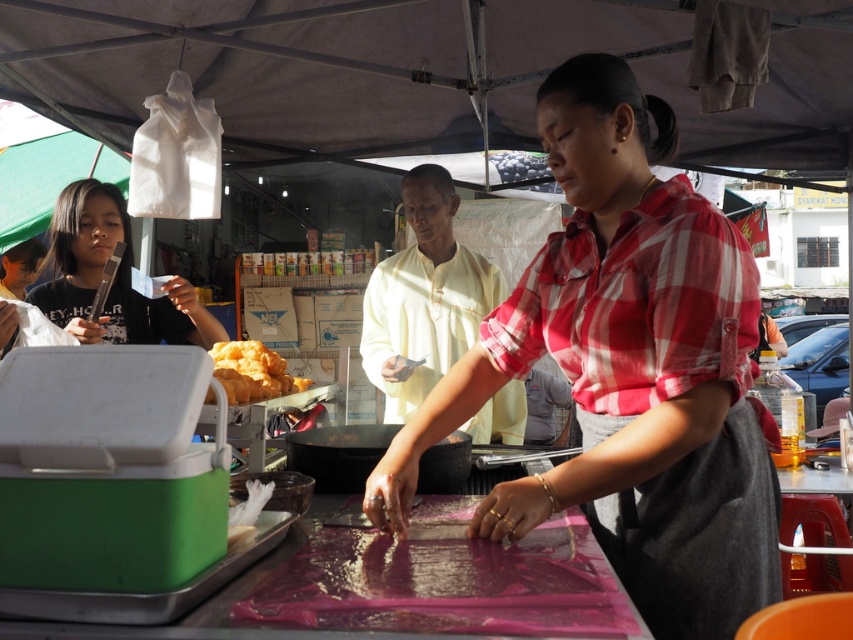
Question: Does yellow cotton shirt at center have a greater width compared to golden crispy fried food at center?

Choices:
 (A) yes
 (B) no

Answer: (A)

Question: Based on their relative distances, which object is farther from the plaid fabric shirt at center?

Choices:
 (A) yellow cotton shirt at center
 (B) black matte shirt at left

Answer: (A)

Question: Estimate the real-world distances between objects in this image. Which object is closer to the yellow cotton shirt at center?

Choices:
 (A) plaid fabric shirt at center
 (B) golden crispy fried food at center

Answer: (B)

Question: Can you confirm if black matte shirt at left is positioned below golden crispy fried food at center?

Choices:
 (A) yes
 (B) no

Answer: (B)

Question: Can you confirm if plaid fabric shirt at center is positioned below black matte shirt at left?

Choices:
 (A) yes
 (B) no

Answer: (A)

Question: Which point is farther to the camera?

Choices:
 (A) (265, 371)
 (B) (161, 326)

Answer: (B)